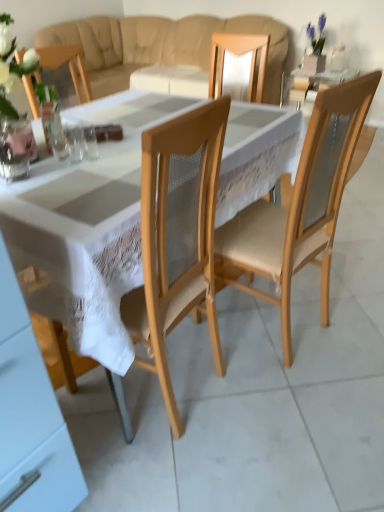
Question: Considering the relative positions of white lace tablecloth at center and clear glass at center, marked as the 2th tableware in a left-to-right arrangement, in the image provided, is white lace tablecloth at center behind clear glass at center, marked as the 2th tableware in a left-to-right arrangement,?

Choices:
 (A) yes
 (B) no

Answer: (B)

Question: Does white lace tablecloth at center have a lesser width compared to clear glass at center, which ranks as the 2th tableware in right-to-left order?

Choices:
 (A) yes
 (B) no

Answer: (B)

Question: Is white lace tablecloth at center outside of clear glass at center, which ranks as the 2th tableware in right-to-left order?

Choices:
 (A) no
 (B) yes

Answer: (B)

Question: From the image's perspective, would you say white lace tablecloth at center is positioned over clear glass at center, marked as the 2th tableware in a left-to-right arrangement?

Choices:
 (A) no
 (B) yes

Answer: (A)

Question: Can you confirm if white lace tablecloth at center is smaller than clear glass at center, marked as the 2th tableware in a left-to-right arrangement?

Choices:
 (A) yes
 (B) no

Answer: (B)

Question: Is clear glass at center, the 1th tableware from the left, to the left or to the right of beige fabric couch at upper center in the image?

Choices:
 (A) right
 (B) left

Answer: (B)

Question: Relative to beige fabric couch at upper center, is clear glass at center, the 1th tableware from the left, in front or behind?

Choices:
 (A) behind
 (B) front

Answer: (B)

Question: Looking at their shapes, would you say clear glass at center, the 1th tableware from the left, is wider or thinner than beige fabric couch at upper center?

Choices:
 (A) wide
 (B) thin

Answer: (B)

Question: From the image's perspective, is clear glass at center, which is counted as the third tableware, starting from the right, positioned above or below beige fabric couch at upper center?

Choices:
 (A) above
 (B) below

Answer: (B)

Question: Does point (29, 249) appear closer or farther from the camera than point (67, 137)?

Choices:
 (A) closer
 (B) farther

Answer: (A)

Question: In the image, is white lace tablecloth at center positioned in front of or behind clear glass at center, which ranks as the 2th tableware in right-to-left order?

Choices:
 (A) behind
 (B) front

Answer: (B)

Question: From a real-world perspective, is white lace tablecloth at center physically located above or below clear glass at center, marked as the 2th tableware in a left-to-right arrangement?

Choices:
 (A) below
 (B) above

Answer: (A)

Question: Based on their sizes in the image, would you say white lace tablecloth at center is bigger or smaller than clear glass at center, marked as the 2th tableware in a left-to-right arrangement?

Choices:
 (A) big
 (B) small

Answer: (A)

Question: From the image's perspective, is beige fabric couch at upper center located above or below white glossy cabinet at lower left?

Choices:
 (A) above
 (B) below

Answer: (A)

Question: Is beige fabric couch at upper center inside or outside of white glossy cabinet at lower left?

Choices:
 (A) outside
 (B) inside

Answer: (A)